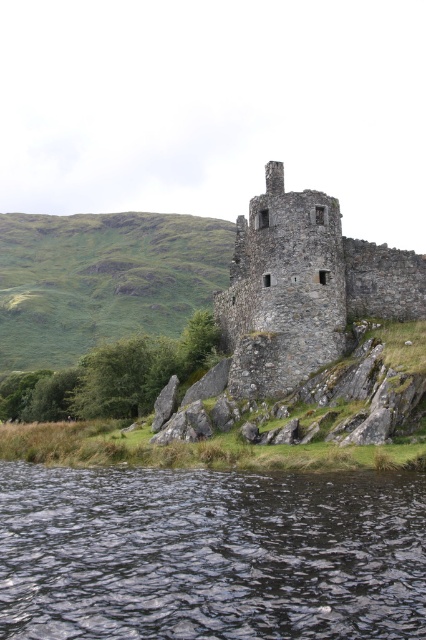
Is dark liquid water at lower center thinner than rustic stone tower at center?

No.

Image resolution: width=426 pixels, height=640 pixels. Describe the element at coordinates (209, 554) in the screenshot. I see `dark liquid water at lower center` at that location.

Is point (423, 499) positioned after point (284, 253)?

No, it is not.

Where is `dark liquid water at lower center`? Image resolution: width=426 pixels, height=640 pixels. dark liquid water at lower center is located at coordinates (209, 554).